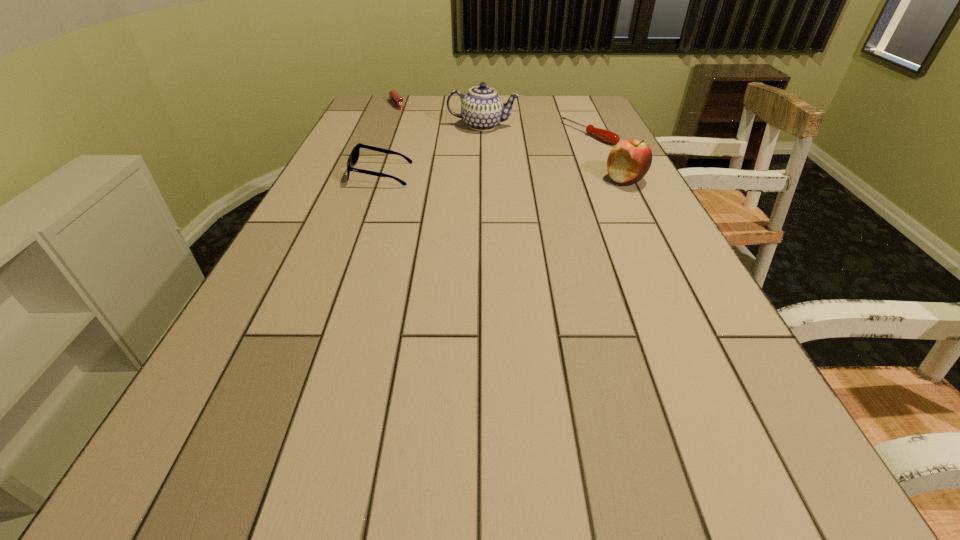
Locate an element on the screen. The image size is (960, 540). chinaware that is positioned at the far edge is located at coordinates point(482,108).

This screenshot has width=960, height=540. Find the location of `stapler positioned at the far edge`. stapler positioned at the far edge is located at coordinates (394, 97).

The image size is (960, 540). I want to click on sunglasses that is at the left edge, so click(x=354, y=156).

At what (x,y) coordinates should I click in order to perform the action: click on stapler located at the left edge. Please return your answer as a coordinate pair (x, y). This screenshot has height=540, width=960. Looking at the image, I should click on (394, 97).

You are a GUI agent. You are given a task and a screenshot of the screen. Output one action in this format:
    pyautogui.click(x=<x>, y=<y>)
    Task: Click on the apple that is at the right edge
    This screenshot has width=960, height=540.
    Given the screenshot: What is the action you would take?
    (x=628, y=162)

The image size is (960, 540). Find the location of `screwdriver at the right edge`. screwdriver at the right edge is located at coordinates (607, 136).

I want to click on object positioned at the far left corner, so click(x=394, y=97).

In the image, there is a desktop. Where is `blank space at the far edge`? The width and height of the screenshot is (960, 540). blank space at the far edge is located at coordinates (419, 109).

At what (x,y) coordinates should I click in order to perform the action: click on free space at the near edge. Please return your answer as a coordinate pair (x, y). This screenshot has height=540, width=960. Looking at the image, I should click on (415, 446).

This screenshot has height=540, width=960. In order to click on vacant space at the left edge of the desktop in this screenshot , I will do `click(343, 153)`.